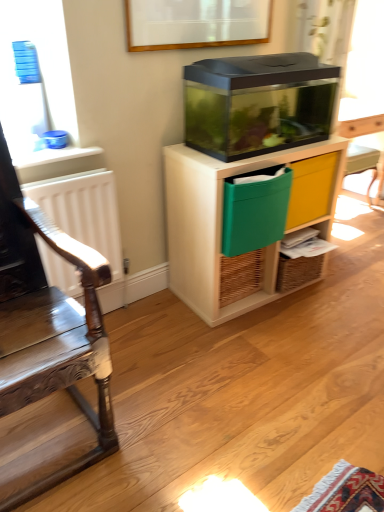
Describe the element at coordinates (87, 219) in the screenshot. I see `white matte radiator at left` at that location.

The image size is (384, 512). What do you see at coordinates (312, 188) in the screenshot?
I see `green fabric drawer at center-right` at bounding box center [312, 188].

Locate an element on the screen. transparent plastic cabinet at center is located at coordinates (222, 222).

The image size is (384, 512). Describe the element at coordinates (49, 324) in the screenshot. I see `wooden polished chair at left` at that location.

This screenshot has width=384, height=512. What do you see at coordinates (255, 212) in the screenshot? I see `green fabric crate at center` at bounding box center [255, 212].

This screenshot has width=384, height=512. Identify the location of green fabric crate at center. (255, 212).

Where is `white matte radiator at left`? This screenshot has width=384, height=512. white matte radiator at left is located at coordinates (87, 219).

Is transparent plastic cabinet at center far away from wooden polished chair at left?

That's not correct — transparent plastic cabinet at center is a little close to wooden polished chair at left.

Considering the positions of points (199, 206) and (13, 213), is point (199, 206) closer to camera compared to point (13, 213)?

No, it is behind (13, 213).

Between transparent plastic cabinet at center and wooden polished chair at left, which one is positioned behind?

transparent plastic cabinet at center is further from the camera.

In the scene shown: From the image's perspective, which is above, transparent plastic cabinet at center or wooden polished chair at left?

transparent plastic cabinet at center appears higher in the image.

Find the location of a particular element. crate that is behind the white matte radiator at left is located at coordinates (255, 212).

Can you confirm if white matte radiator at left is smaller than green fabric crate at center?

Correct, white matte radiator at left occupies less space than green fabric crate at center.

From a real-world perspective, is white matte radiator at left above or below green fabric crate at center?

In terms of real-world spatial position, white matte radiator at left is below green fabric crate at center.

In the image, is white matte radiator at left on the left side or the right side of green fabric crate at center?

white matte radiator at left is positioned on green fabric crate at center's left side.

Considering the sizes of green fabric crate at center and green fabric drawer at center-right in the image, is green fabric crate at center wider or thinner than green fabric drawer at center-right?

Clearly, green fabric crate at center has more width compared to green fabric drawer at center-right.

From the image's perspective, which one is positioned lower, green fabric crate at center or green fabric drawer at center-right?

green fabric crate at center is shown below in the image.

From a real-world perspective, is green fabric crate at center physically below green fabric drawer at center-right?

No, from a real-world perspective, green fabric crate at center is not beneath green fabric drawer at center-right.

Is green fabric crate at center in contact with green fabric drawer at center-right?

No, green fabric crate at center is not touching green fabric drawer at center-right.

Is point (104, 338) behind point (115, 215)?

No, it is not.

Is wooden polished chair at left wider than white matte radiator at left?

Yes, wooden polished chair at left is wider than white matte radiator at left.

From a real-world perspective, which is physically below, wooden polished chair at left or white matte radiator at left?

white matte radiator at left is physically lower.

Looking at this image, in the image, is wooden polished chair at left on the left side or the right side of white matte radiator at left?

wooden polished chair at left is positioned on white matte radiator at left's left side.

Between green fabric drawer at center-right and transparent plastic cabinet at center, which one has more height?

transparent plastic cabinet at center is taller.

Is green fabric drawer at center-right aimed at transparent plastic cabinet at center?

Yes, green fabric drawer at center-right faces towards transparent plastic cabinet at center.

Is green fabric drawer at center-right placed right next to transparent plastic cabinet at center?

green fabric drawer at center-right and transparent plastic cabinet at center are not in contact.

Which is correct: green fabric drawer at center-right is inside transparent plastic cabinet at center, or outside of it?

green fabric drawer at center-right is spatially positioned inside transparent plastic cabinet at center.

Is green fabric crate at center at the right side of transparent plastic cabinet at center?

No.

Locate an element on the screen. cabinetry below the green fabric crate at center (from a real-world perspective) is located at coordinates (222, 222).

From a real-world perspective, is green fabric crate at center positioned above or below transparent plastic cabinet at center?

green fabric crate at center is situated higher than transparent plastic cabinet at center in the real world.

Does green fabric crate at center appear on the left side of wooden polished chair at left?

In fact, green fabric crate at center is to the right of wooden polished chair at left.

How different are the orientations of green fabric crate at center and wooden polished chair at left in degrees?

The angular difference between green fabric crate at center and wooden polished chair at left is 2.92 degrees.

Which is behind, point (228, 252) or point (101, 413)?

Point (228, 252)

Is green fabric crate at center located outside wooden polished chair at left?

Yes, green fabric crate at center is not within wooden polished chair at left.

What are the coordinates of `chair that appears in front of the transparent plastic cabinet at center` in the screenshot? It's located at (49, 324).

You are a GUI agent. You are given a task and a screenshot of the screen. Output one action in this format:
    pyautogui.click(x=<x>, y=<y>)
    Task: Click on the radiator beneath the green fabric crate at center (from a real-world perspective)
    
    Given the screenshot: What is the action you would take?
    pyautogui.click(x=87, y=219)

Estimate the real-world distances between objects in this image. Which object is further from transparent plastic cabinet at center, green fabric crate at center or white matte radiator at left?

white matte radiator at left is further to transparent plastic cabinet at center.

Looking at the image, which one is located further to wooden polished chair at left, green fabric drawer at center-right or green fabric crate at center?

The object further to wooden polished chair at left is green fabric drawer at center-right.

Which object lies nearer to the anchor point transparent plastic cabinet at center, wooden polished chair at left or white matte radiator at left?

The object closer to transparent plastic cabinet at center is white matte radiator at left.

Based on their spatial positions, is white matte radiator at left or green fabric crate at center closer to transparent plastic cabinet at center?

green fabric crate at center.

Considering their positions, is transparent plastic cabinet at center positioned further to green fabric crate at center than white matte radiator at left?

white matte radiator at left.

Which object lies further to the anchor point wooden polished chair at left, green fabric crate at center or white matte radiator at left?

green fabric crate at center is further to wooden polished chair at left.

Based on the photo, when comparing their distances from white matte radiator at left, does green fabric drawer at center-right or wooden polished chair at left seem closer?

wooden polished chair at left is closer to white matte radiator at left.

Estimate the real-world distances between objects in this image. Which object is closer to green fabric drawer at center-right, white matte radiator at left or wooden polished chair at left?

white matte radiator at left lies closer to green fabric drawer at center-right than the other object.

Locate an element on the screen. This screenshot has height=512, width=384. radiator located between wooden polished chair at left and transparent plastic cabinet at center in the depth direction is located at coordinates (87, 219).

Identify the location of cabinetry between green fabric crate at center and green fabric drawer at center-right from left to right. (222, 222).

Find the location of a particular element. radiator between wooden polished chair at left and green fabric crate at center in the front-back direction is located at coordinates (87, 219).

At what (x,y) coordinates should I click in order to perform the action: click on cabinetry situated between white matte radiator at left and green fabric drawer at center-right from left to right. Please return your answer as a coordinate pair (x, y). The width and height of the screenshot is (384, 512). Looking at the image, I should click on tap(222, 222).